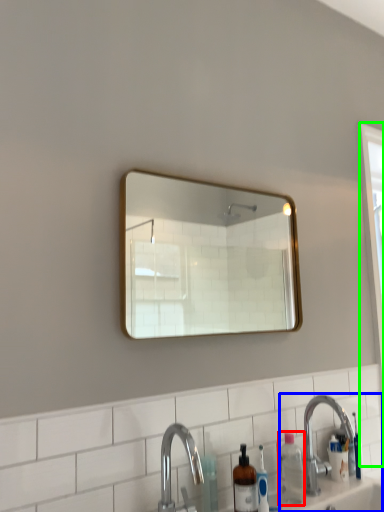
Question: Which is farther away from bottle (highlighted by a red box)? sink (highlighted by a blue box) or screen door (highlighted by a green box)?

Choices:
 (A) sink
 (B) screen door

Answer: (B)